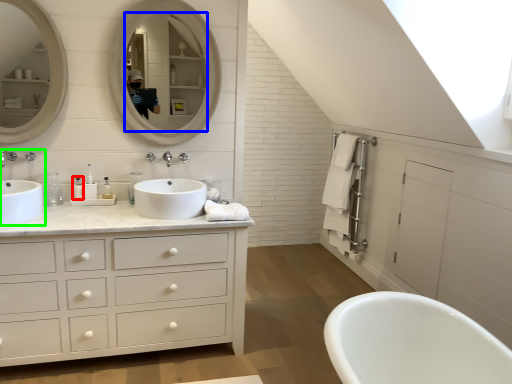
Question: Which is nearer to the toiletry (highlighted by a red box)? mirror (highlighted by a blue box) or sink (highlighted by a green box).

Choices:
 (A) mirror
 (B) sink

Answer: (B)